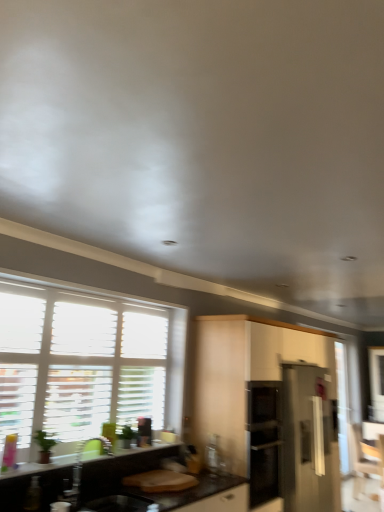
Identify the location of empty space that is ontop of black laminate countertop at lower left (from a real-world perspective). (107, 452).